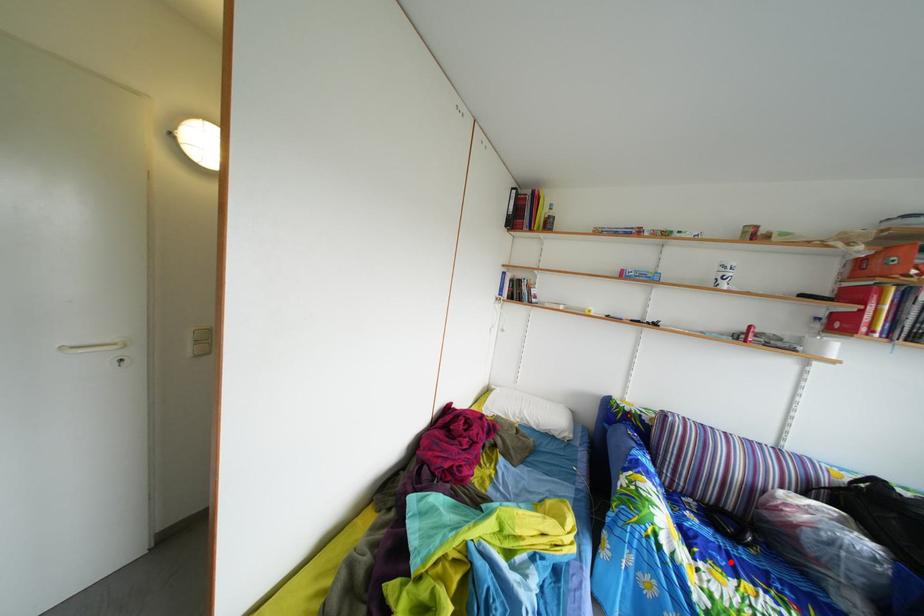
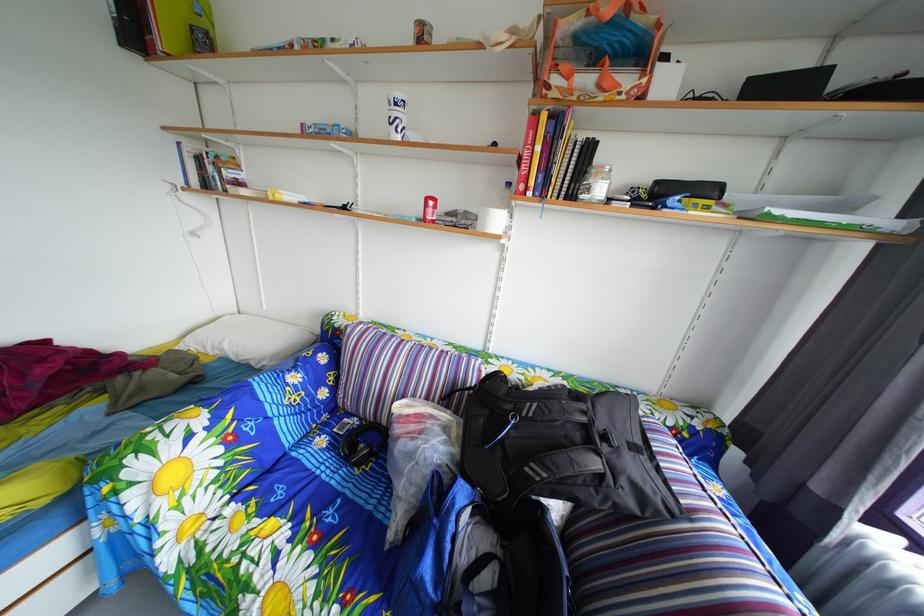
Find the pixel in the second image that matches the highlighted location in the first image.

(301, 493)